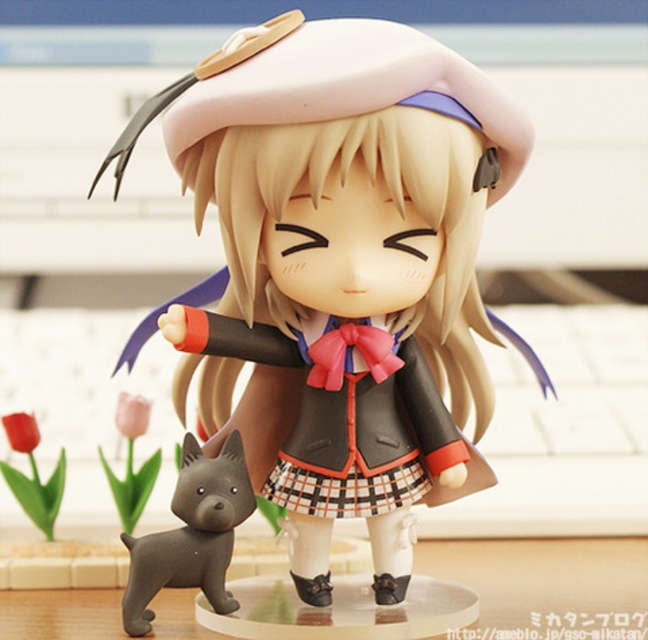
Can you confirm if plaid fabric dress at center is thinner than smooth gray dog at lower left?

In fact, plaid fabric dress at center might be wider than smooth gray dog at lower left.

Does point (314, 403) lie in front of point (200, 509)?

No, (314, 403) is behind (200, 509).

Where is `plaid fabric dress at center`? plaid fabric dress at center is located at coordinates (349, 436).

Can you confirm if matte black doll at center is taller than plaid fabric dress at center?

Yes.

Can you confirm if matte black doll at center is thinner than plaid fabric dress at center?

In fact, matte black doll at center might be wider than plaid fabric dress at center.

Identify the location of matte black doll at center. This screenshot has height=640, width=648. (343, 269).

The height and width of the screenshot is (640, 648). I want to click on matte black doll at center, so click(343, 269).

Who is more distant from viewer, [498,134] or [135,579]?

The point [135,579] is behind.

Where is `matte black doll at center`? This screenshot has height=640, width=648. matte black doll at center is located at coordinates (343, 269).